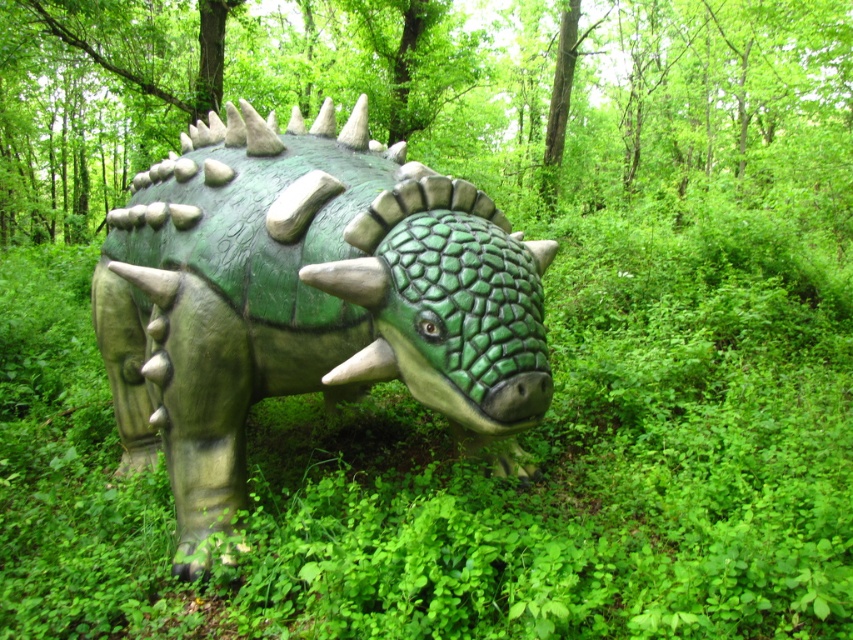
Is point (782, 524) closer to viewer compared to point (196, 420)?

That is True.

Describe the element at coordinates (476, 467) in the screenshot. The width and height of the screenshot is (853, 640). I see `green matte grass at center` at that location.

Between point (125, 636) and point (193, 500), which one is positioned behind?

The point (193, 500) is behind.

You are a GUI agent. You are given a task and a screenshot of the screen. Output one action in this format:
    pyautogui.click(x=<x>, y=<y>)
    Task: Click on the green matte grass at center
    The height and width of the screenshot is (640, 853).
    Given the screenshot: What is the action you would take?
    point(476,467)